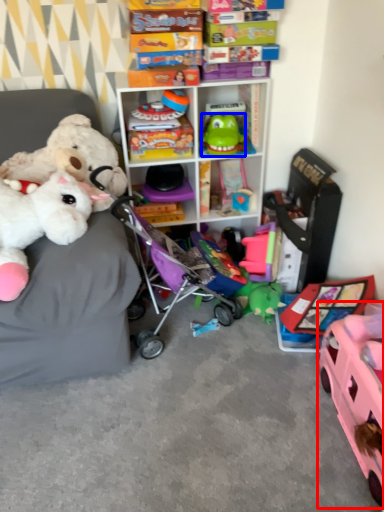
Question: Which point is further to the camera, toy (highlighted by a red box) or toy (highlighted by a blue box)?

Choices:
 (A) toy
 (B) toy

Answer: (B)